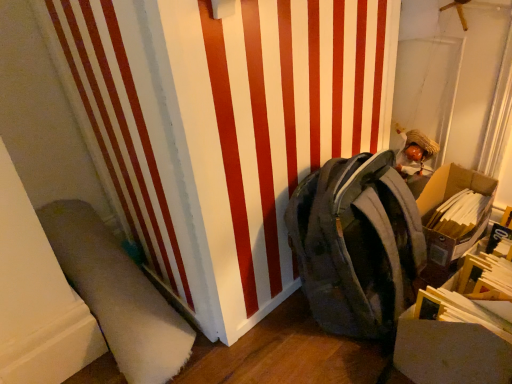
Question: Considering the relative sizes of cardboard box at right and camouflage fabric backpack at center-right in the image provided, is cardboard box at right bigger than camouflage fabric backpack at center-right?

Choices:
 (A) no
 (B) yes

Answer: (A)

Question: Considering the relative positions of cardboard box at right and camouflage fabric backpack at center-right in the image provided, is cardboard box at right to the right of camouflage fabric backpack at center-right from the viewer's perspective?

Choices:
 (A) no
 (B) yes

Answer: (B)

Question: Is camouflage fabric backpack at center-right located within cardboard box at right?

Choices:
 (A) yes
 (B) no

Answer: (B)

Question: Is cardboard box at right smaller than camouflage fabric backpack at center-right?

Choices:
 (A) no
 (B) yes

Answer: (B)

Question: Is cardboard box at right far away from camouflage fabric backpack at center-right?

Choices:
 (A) yes
 (B) no

Answer: (B)

Question: From the image's perspective, is white soft carpet at lower left above or below camouflage fabric backpack at center-right?

Choices:
 (A) above
 (B) below

Answer: (B)

Question: Considering the positions of point (132, 284) and point (368, 301), is point (132, 284) closer or farther from the camera than point (368, 301)?

Choices:
 (A) closer
 (B) farther

Answer: (B)

Question: From a real-world perspective, is white soft carpet at lower left physically located above or below camouflage fabric backpack at center-right?

Choices:
 (A) above
 (B) below

Answer: (B)

Question: In terms of height, does white soft carpet at lower left look taller or shorter compared to camouflage fabric backpack at center-right?

Choices:
 (A) tall
 (B) short

Answer: (B)

Question: Considering the positions of camouflage fabric backpack at center-right and white soft carpet at lower left in the image, is camouflage fabric backpack at center-right taller or shorter than white soft carpet at lower left?

Choices:
 (A) tall
 (B) short

Answer: (A)

Question: Relative to white soft carpet at lower left, is camouflage fabric backpack at center-right in front or behind?

Choices:
 (A) behind
 (B) front

Answer: (B)

Question: Looking at their shapes, would you say camouflage fabric backpack at center-right is wider or thinner than white soft carpet at lower left?

Choices:
 (A) wide
 (B) thin

Answer: (B)

Question: Is point (411, 279) positioned closer to the camera than point (80, 228)?

Choices:
 (A) farther
 (B) closer

Answer: (A)

Question: Considering the relative positions of cardboard box at right and camouflage fabric backpack at center-right in the image provided, is cardboard box at right to the left or to the right of camouflage fabric backpack at center-right?

Choices:
 (A) right
 (B) left

Answer: (A)

Question: Based on their sizes in the image, would you say cardboard box at right is bigger or smaller than camouflage fabric backpack at center-right?

Choices:
 (A) small
 (B) big

Answer: (A)